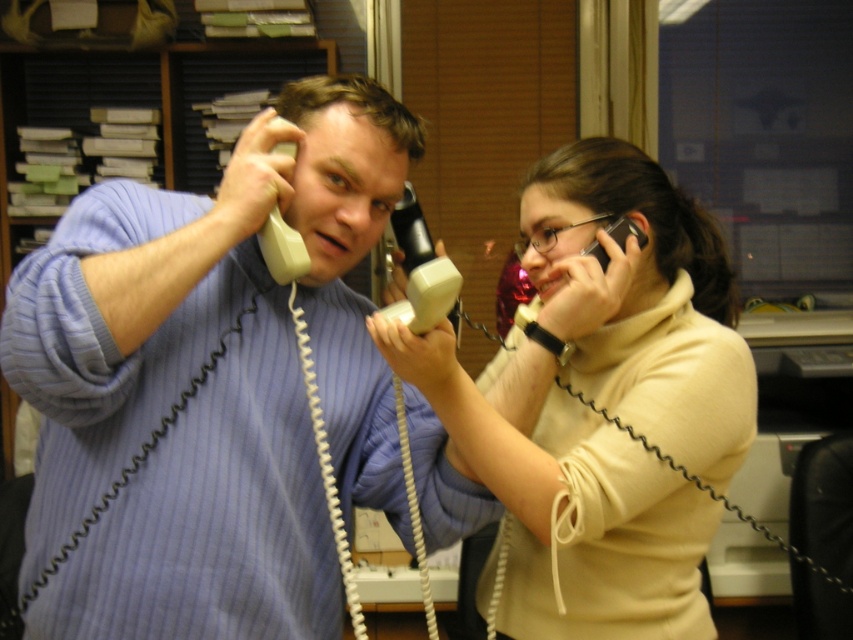
Question: Does white plastic phone at center appear over black plastic phone at upper right?

Choices:
 (A) no
 (B) yes

Answer: (A)

Question: Is matte beige sweater at center further to camera compared to white plastic phone at center?

Choices:
 (A) no
 (B) yes

Answer: (B)

Question: Which point is farther to the camera?

Choices:
 (A) black plastic phone at upper right
 (B) matte blue sweater at center

Answer: (A)

Question: Does matte beige sweater at center have a larger size compared to black plastic phone at upper right?

Choices:
 (A) no
 (B) yes

Answer: (B)

Question: Which object is the farthest from the matte blue sweater at center?

Choices:
 (A) white plastic phone at center
 (B) black plastic phone at upper right
 (C) matte beige sweater at center

Answer: (B)

Question: Which point is farther from the camera taking this photo?

Choices:
 (A) (621, 220)
 (B) (407, 232)

Answer: (B)